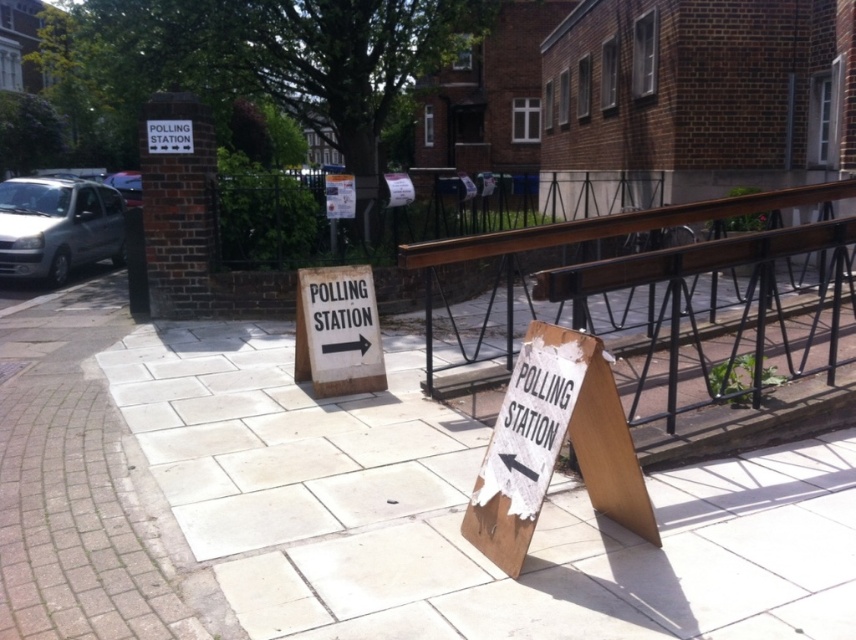
Question: Does wooden sign at lower right appear under brown wooden rail at center?

Choices:
 (A) yes
 (B) no

Answer: (A)

Question: Estimate the real-world distances between objects in this image. Which object is farther from the brown wooden rail at center?

Choices:
 (A) white cardboard sign at center
 (B) wooden sign at lower right
 (C) white stone pavement at center

Answer: (C)

Question: Is white stone pavement at center thinner than wooden sign at lower right?

Choices:
 (A) yes
 (B) no

Answer: (A)

Question: Which object appears farthest from the camera in this image?

Choices:
 (A) brown wooden rail at center
 (B) white stone pavement at center
 (C) white cardboard sign at center
 (D) wooden sign at lower right

Answer: (C)

Question: Which point appears closest to the camera in this image?

Choices:
 (A) (670, 209)
 (B) (605, 397)
 (C) (325, 371)
 (D) (765, 564)

Answer: (B)

Question: Is brown wooden rail at center to the left of white cardboard sign at center from the viewer's perspective?

Choices:
 (A) no
 (B) yes

Answer: (A)